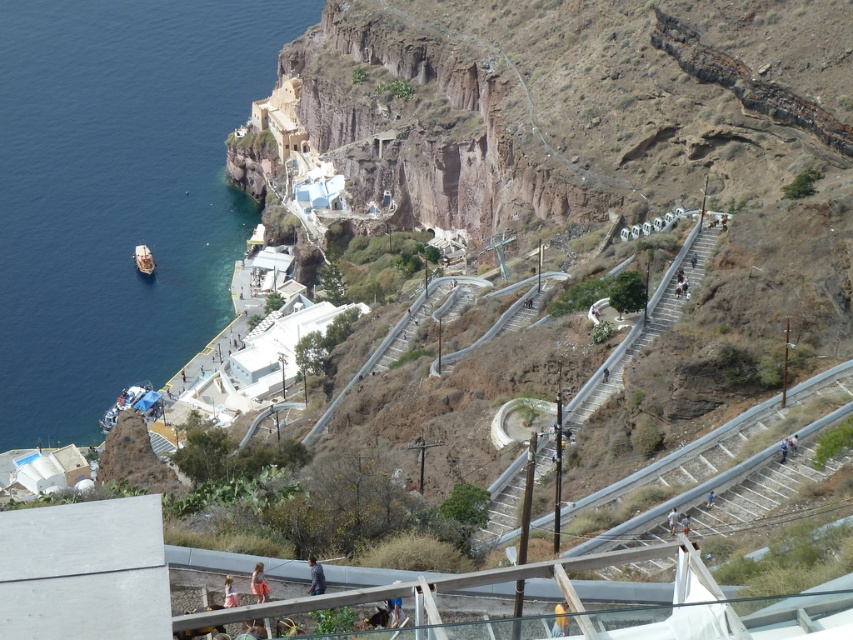
You are standing on the curved staircases looking towards the harbor. You see the blue liquid water at lower left and the matte pink dress at center. Which object is closer to you?

The blue liquid water at lower left is closer to you because it is further to the viewer than the matte pink dress at center.

You are a painter standing on the cliffside and want to set up your easel between the light blue fabric at center and the light brown wooden bench at center. The easel requires 5 meters of space. Can you fit it there?

The distance between the light blue fabric at center and the light brown wooden bench at center is 6.14 meters. Since the easel needs 5 meters, there is enough space to fit it between them.

You are a photographer planning to capture a wide shot of the coastal scene. You want to ensure that both the blue liquid water at lower left and the matte pink dress at center are visible in your frame. Based on their sizes in the scene, which object will occupy more of the horizontal space in your photograph?

The blue liquid water at lower left will occupy more horizontal space in the photograph because its width is larger than that of the matte pink dress at center.